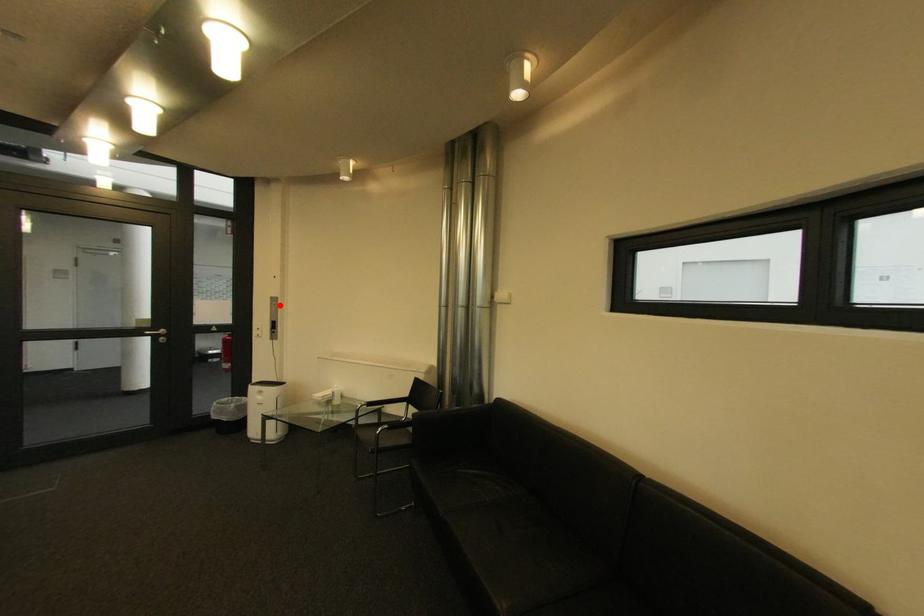
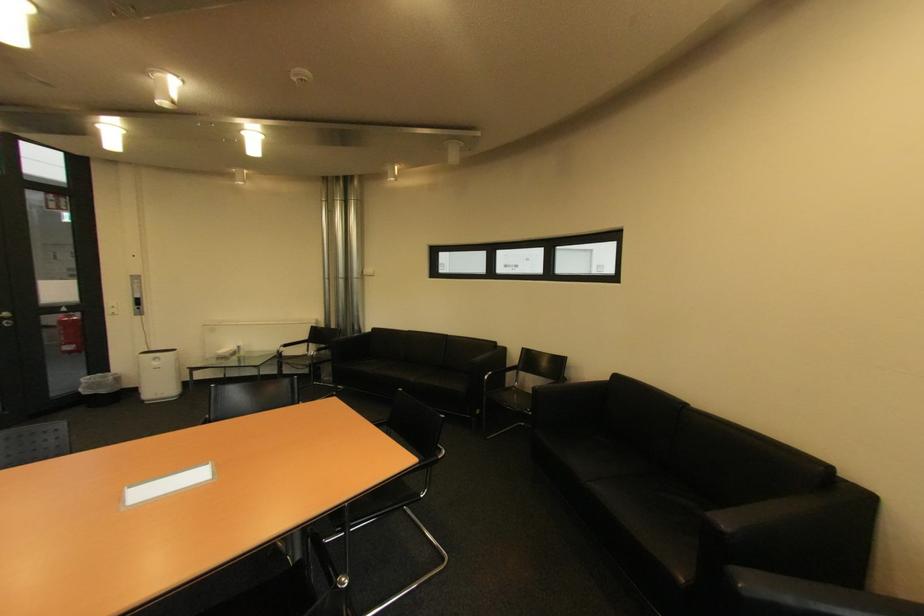
In the second image, find the point that corresponds to the highlighted location in the first image.

(140, 283)